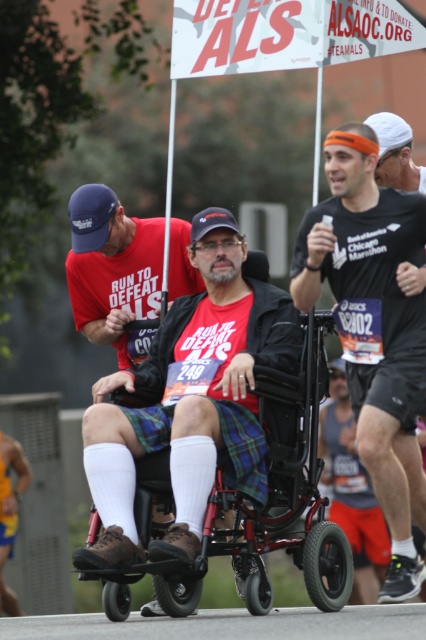
Question: Is matte black shirt at center to the left of metallic red wheelchair at center from the viewer's perspective?

Choices:
 (A) yes
 (B) no

Answer: (B)

Question: Does matte black shirt at center have a larger size compared to metallic red wheelchair at center?

Choices:
 (A) yes
 (B) no

Answer: (B)

Question: Which object appears closest to the camera in this image?

Choices:
 (A) matte black shirt at center
 (B) metallic red wheelchair at center

Answer: (B)

Question: Is matte black shirt at center smaller than metallic red wheelchair at center?

Choices:
 (A) yes
 (B) no

Answer: (A)

Question: Which point appears closest to the camera in this image?

Choices:
 (A) (106, 595)
 (B) (367, 244)

Answer: (A)